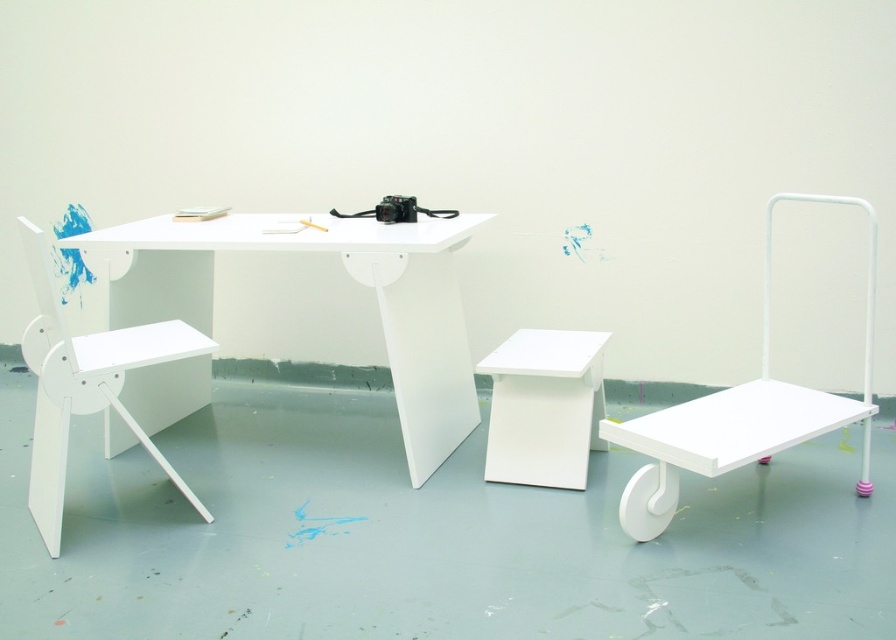
Is white matte table at center closer to the viewer compared to white matte chair at left?

That is False.

Between point (210, 305) and point (28, 346), which one is positioned behind?

The point (210, 305) is more distant.

The width and height of the screenshot is (896, 640). In order to click on white matte table at center in this screenshot , I will do click(316, 298).

Find the location of a particular element. white matte chair at left is located at coordinates (85, 385).

Who is more forward, [40,266] or [521,465]?

Point [40,266] is more forward.

The width and height of the screenshot is (896, 640). In order to click on white matte chair at left in this screenshot , I will do `click(85, 385)`.

Who is more distant from viewer, (177, 284) or (575, 467)?

The point (177, 284) is more distant.

From the picture: Who is more forward, (390, 336) or (533, 339)?

Positioned in front is point (390, 336).

Locate an element on the screen. The image size is (896, 640). white matte table at center is located at coordinates pos(316,298).

Image resolution: width=896 pixels, height=640 pixels. I want to click on white matte table at center, so click(316, 298).